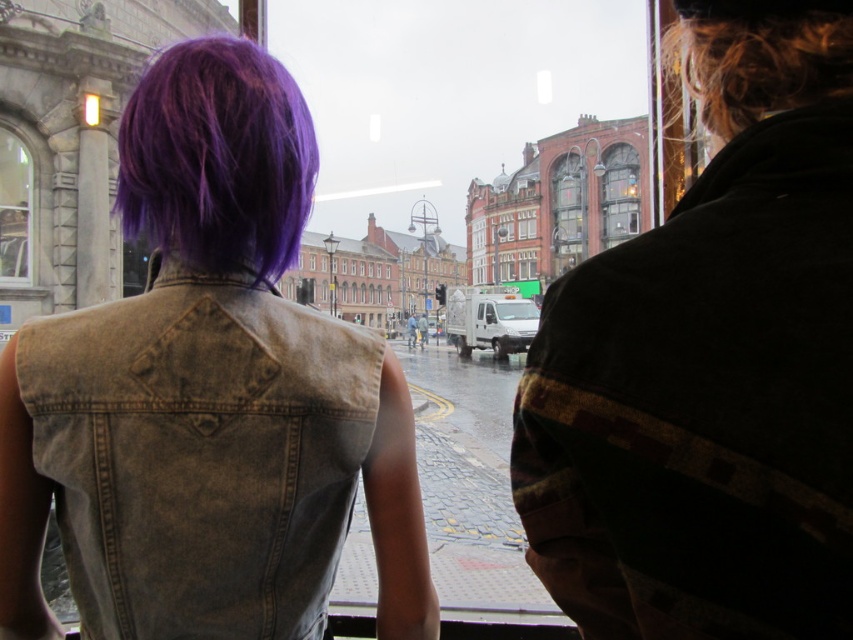
Question: Which of the following is the closest to the observer?

Choices:
 (A) clear glass window at upper left
 (B) blonde curly hair at upper right
 (C) glassy brown window at center

Answer: (B)

Question: Considering the relative positions of purple hair at upper left and clear glass window at upper left in the image provided, where is purple hair at upper left located with respect to clear glass window at upper left?

Choices:
 (A) below
 (B) above

Answer: (A)

Question: Which object is positioned farthest from the purple hair at upper left?

Choices:
 (A) blonde curly hair at upper right
 (B) glass window at center
 (C) glassy brown window at center

Answer: (C)

Question: Which point is farther to the camera?

Choices:
 (A) (761, 209)
 (B) (618, 221)
 (C) (749, 76)
 (D) (189, 246)

Answer: (B)

Question: From the image, what is the correct spatial relationship of purple matte hair at upper left in relation to glassy brown window at center?

Choices:
 (A) left
 (B) right

Answer: (A)

Question: Is blonde curly hair at upper right thinner than clear glass window at upper left?

Choices:
 (A) no
 (B) yes

Answer: (A)